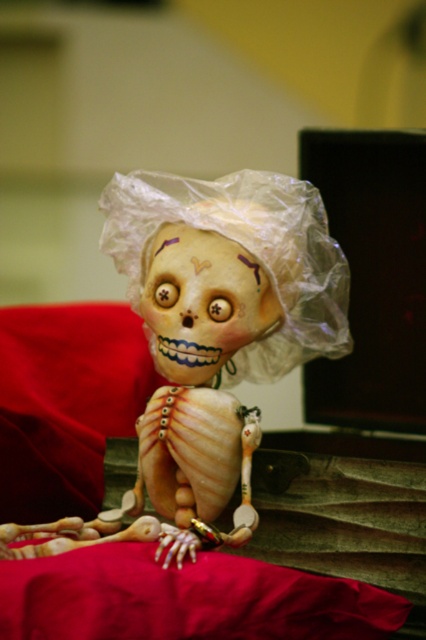
You are holding a camera and want to take a photo of the matte plastic zombie at center. If the camera requires a minimum distance of 30 inches to focus properly, will you need to move closer or farther away to ensure the photo is clear?

The matte plastic zombie at center and camera are 29.24 inches apart from each other. Since the required minimum distance is 30 inches, you need to move farther away to ensure the photo is clear.

You are setting up a Halloween display and have both the matte plastic zombie at center and the transparent plastic doll at center. To ensure the zombie doesn

The matte plastic zombie at center is taller than the transparent plastic doll at center, so placing the zombie behind the doll will create a layered look where the zombie appears to tower over the doll.

In the scene shown: You are a collector who wants to place both the matte plastic zombie at center and the transparent plastic doll at center on a shelf that can only accommodate items spaced exactly 4 centimeters apart. Can you fit both items on the shelf without violating the spacing requirement?

The matte plastic zombie at center and transparent plastic doll at center are 4.37 centimeters apart from each other. Since the shelf requires items to be spaced exactly 4 centimeters apart, the 4.37 centimeter distance between them exceeds the allowed spacing. Therefore, you cannot fit both items on the shelf without violating the spacing requirement.